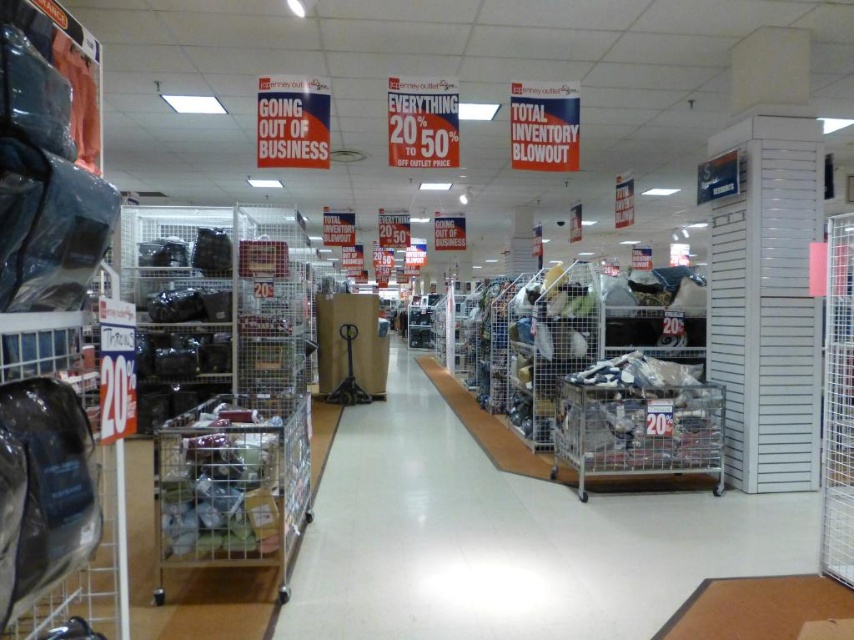
Does metal mesh cart at center have a greater height compared to metallic silver shopping cart at center?

Incorrect, metal mesh cart at center's height is not larger of metallic silver shopping cart at center's.

What do you see at coordinates (509, 538) in the screenshot?
I see `metal mesh cart at center` at bounding box center [509, 538].

The width and height of the screenshot is (854, 640). Find the location of `metal mesh cart at center`. metal mesh cart at center is located at coordinates (509, 538).

Is metal mesh cart at center below metallic silver cart at center?

Yes.

This screenshot has width=854, height=640. I want to click on metal mesh cart at center, so click(509, 538).

Identify the location of metal mesh cart at center. (509, 538).

Does metallic silver shopping cart at center appear on the right side of metallic silver cart at center?

No, metallic silver shopping cart at center is not to the right of metallic silver cart at center.

Can you confirm if metallic silver shopping cart at center is thinner than metallic silver cart at center?

Yes, metallic silver shopping cart at center is thinner than metallic silver cart at center.

At what (x,y) coordinates should I click in order to perform the action: click on metallic silver shopping cart at center. Please return your answer as a coordinate pair (x, y). Looking at the image, I should click on (232, 483).